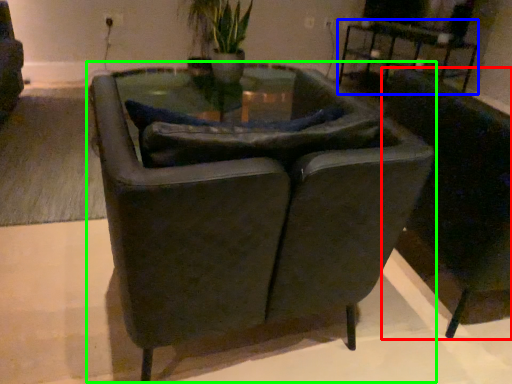
Question: Which object is positioned farthest from chair (highlighted by a red box)? Select from table (highlighted by a blue box) and chair (highlighted by a green box).

Choices:
 (A) table
 (B) chair

Answer: (A)